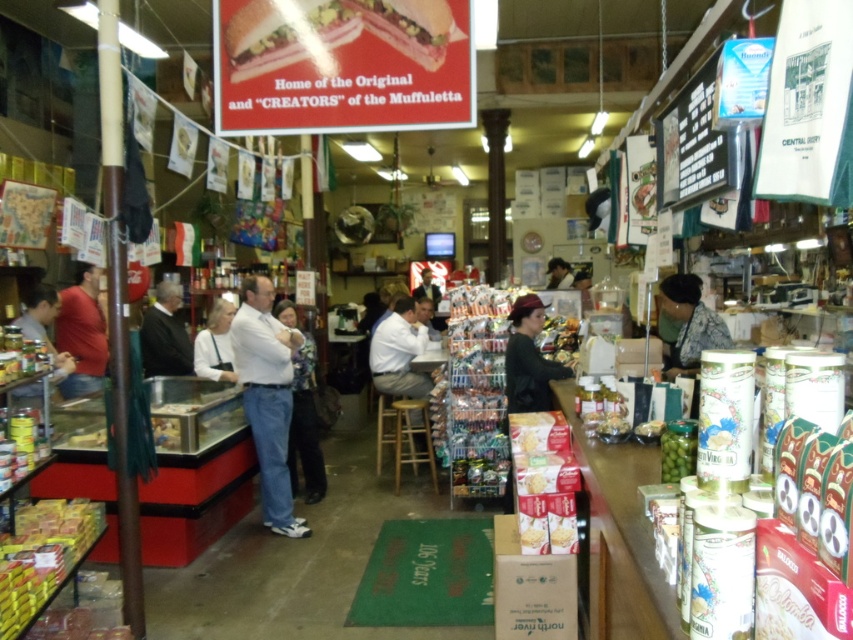
Question: Which point appears farthest from the camera in this image?

Choices:
 (A) (427, 317)
 (B) (97, 310)
 (C) (312, 436)

Answer: (A)

Question: Is light brown leather jacket at center below shiny metallic can at center?

Choices:
 (A) yes
 (B) no

Answer: (A)

Question: Is matte red shirt at left above light brown leather jacket at center?

Choices:
 (A) yes
 (B) no

Answer: (A)

Question: Among these objects, which one is nearest to the camera?

Choices:
 (A) black sweater at center
 (B) green glass jar at lower right
 (C) matte black shirt at left

Answer: (B)

Question: Is matte red shirt at left in front of light brown leather jacket at center?

Choices:
 (A) yes
 (B) no

Answer: (A)

Question: Among these points, which one is nearest to the camera?

Choices:
 (A) (566, 355)
 (B) (204, 333)
 (C) (279, 451)
 (D) (175, 362)

Answer: (C)